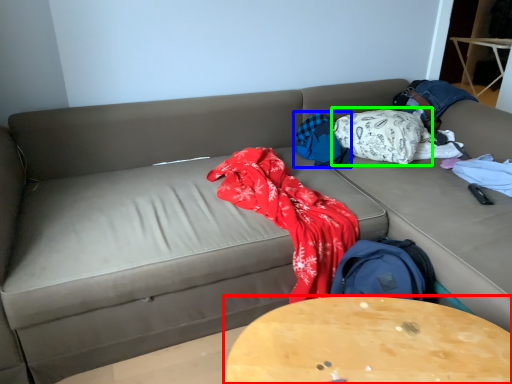
Question: Estimate the real-world distances between objects in this image. Which object is farther from table (highlighted by a red box), blanket (highlighted by a blue box) or blanket (highlighted by a green box)?

Choices:
 (A) blanket
 (B) blanket

Answer: (B)